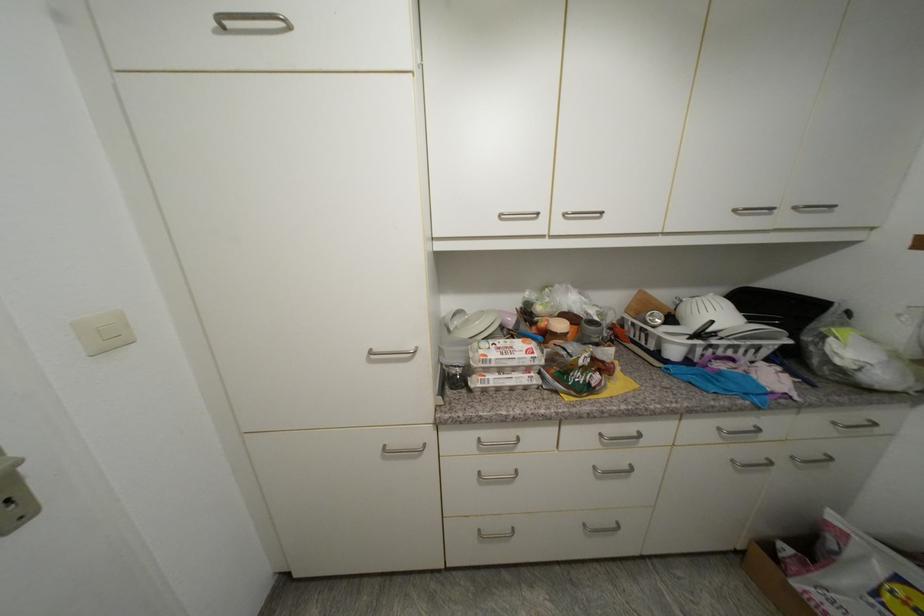
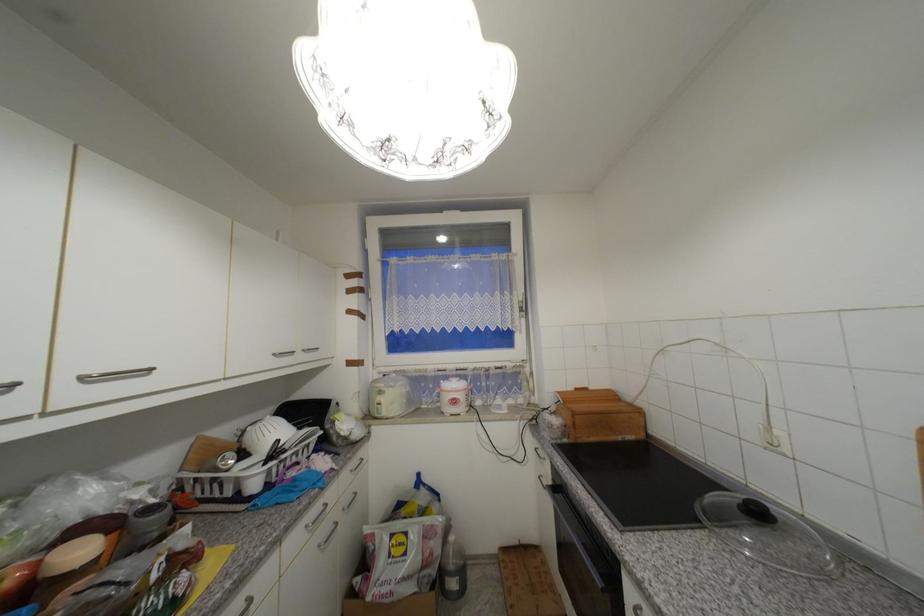
Locate, in the second image, the point that corresponds to [740,213] in the first image.

(281, 355)